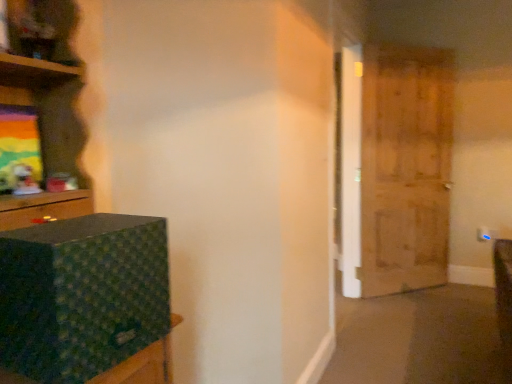
What do you see at coordinates (404, 167) in the screenshot?
I see `wooden door at right` at bounding box center [404, 167].

This screenshot has width=512, height=384. Find the location of `wooden door at right`. wooden door at right is located at coordinates (404, 167).

What are the coordinates of `green fabric box at left` in the screenshot? It's located at (82, 295).

What do you see at coordinates (82, 295) in the screenshot? I see `green fabric box at left` at bounding box center [82, 295].

Locate an element on the screen. Image resolution: width=512 pixels, height=384 pixels. wooden door at right is located at coordinates (404, 167).

Is green fabric box at left at the right side of wooden door at right?

No.

Is green fabric box at left positioned in front of wooden door at right?

Yes.

Is point (124, 266) farther from camera compared to point (414, 283)?

No, it is in front of (414, 283).

Looking at this image, from the image's perspective, which object appears higher, green fabric box at left or wooden door at right?

wooden door at right, from the image's perspective.

From a real-world perspective, is green fabric box at left physically located above or below wooden door at right?

From a real-world perspective, green fabric box at left is physically below wooden door at right.

Considering the sizes of objects green fabric box at left and wooden door at right in the image provided, who is wider, green fabric box at left or wooden door at right?

green fabric box at left.

Is green fabric box at left taller than wooden door at right?

In fact, green fabric box at left may be shorter than wooden door at right.

Based on the photo, who is smaller, green fabric box at left or wooden door at right?

With smaller size is green fabric box at left.

Is green fabric box at left located outside wooden door at right?

green fabric box at left lies outside wooden door at right's area.

Is green fabric box at left next to wooden door at right?

No, green fabric box at left is not in contact with wooden door at right.

Is green fabric box at left facing away from wooden door at right?

No, green fabric box at left is not facing away from wooden door at right.

From the picture: How far apart are green fabric box at left and wooden door at right?

green fabric box at left and wooden door at right are 2.70 meters apart from each other.

At what (x,y) coordinates should I click in order to perform the action: click on box on the left of wooden door at right. Please return your answer as a coordinate pair (x, y). This screenshot has width=512, height=384. Looking at the image, I should click on (82, 295).

Which object is positioned more to the left, wooden door at right or green fabric box at left?

Positioned to the left is green fabric box at left.

Consider the image. Which object is closer to the camera, wooden door at right or green fabric box at left?

green fabric box at left is in front.

Considering the points (372, 155) and (146, 297), which point is behind, point (372, 155) or point (146, 297)?

The point (372, 155) is behind.

From the image's perspective, is wooden door at right over green fabric box at left?

Yes, from the image's perspective, wooden door at right is above green fabric box at left.

From a real-world perspective, is wooden door at right positioned under green fabric box at left based on gravity?

Actually, wooden door at right is physically above green fabric box at left in the real world.

Can you confirm if wooden door at right is thinner than green fabric box at left?

Indeed, wooden door at right has a lesser width compared to green fabric box at left.

Between wooden door at right and green fabric box at left, which one has more height?

wooden door at right is taller.

Which of these two, wooden door at right or green fabric box at left, is smaller?

green fabric box at left is smaller.

Could green fabric box at left be considered to be inside wooden door at right?

No, wooden door at right does not contain green fabric box at left.

Is wooden door at right touching green fabric box at left?

No, wooden door at right is not touching green fabric box at left.

Is wooden door at right positioned with its back to green fabric box at left?

That's not correct — wooden door at right is not looking away from green fabric box at left.

Find the location of a particular element. This screenshot has height=384, width=512. door behind the green fabric box at left is located at coordinates (404, 167).

Image resolution: width=512 pixels, height=384 pixels. What are the coordinates of `door located behind the green fabric box at left` in the screenshot? It's located at (404, 167).

Image resolution: width=512 pixels, height=384 pixels. I want to click on box to the left of wooden door at right, so click(82, 295).